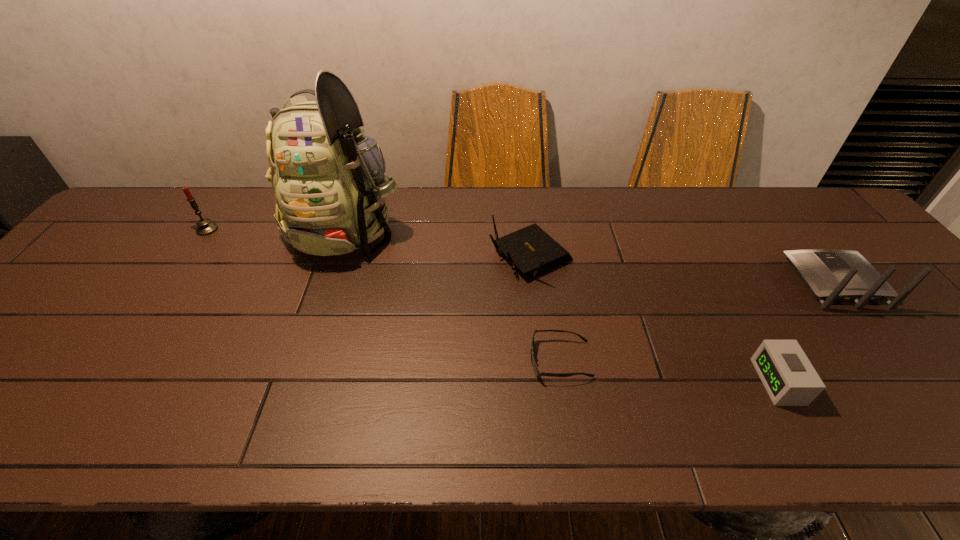
Image resolution: width=960 pixels, height=540 pixels. Find the location of `free region located 0.120m on the front-facing side of the second object from left to right`. free region located 0.120m on the front-facing side of the second object from left to right is located at coordinates (321, 306).

The image size is (960, 540). Find the location of `vacant space located on the right of the candle`. vacant space located on the right of the candle is located at coordinates pyautogui.click(x=352, y=230).

You are a GUI agent. You are given a task and a screenshot of the screen. Output one action in this format:
    pyautogui.click(x=<x>, y=<y>)
    Task: Click on the free space located 0.250m on the front-facing side of the rightmost object
    The height and width of the screenshot is (540, 960).
    Given the screenshot: What is the action you would take?
    pyautogui.click(x=773, y=204)

Find the location of `free space located 0.070m on the front-facing side of the rightmost object`. free space located 0.070m on the front-facing side of the rightmost object is located at coordinates (803, 241).

Find the location of a particular element. free spot located 0.120m on the front-facing side of the rightmost object is located at coordinates (794, 230).

What are the coordinates of `free space located 0.320m on the front of the left router` in the screenshot? It's located at (547, 397).

I want to click on vacant space located 0.170m on the front-facing side of the alarm clock, so click(682, 382).

You are a GUI agent. You are given a task and a screenshot of the screen. Output one action in this format:
    pyautogui.click(x=<x>, y=<y>)
    Task: Click on the vacant area located on the front-facing side of the alarm clock
    
    Given the screenshot: What is the action you would take?
    pyautogui.click(x=616, y=382)

I want to click on vacant area situated 0.120m on the front-facing side of the alarm clock, so (706, 382).

You are a GUI agent. You are given a task and a screenshot of the screen. Output one action in this format:
    pyautogui.click(x=<x>, y=<y>)
    Task: Click on the blank area located 0.160m on the front-facing side of the sunglasses
    
    Given the screenshot: What is the action you would take?
    pyautogui.click(x=458, y=360)